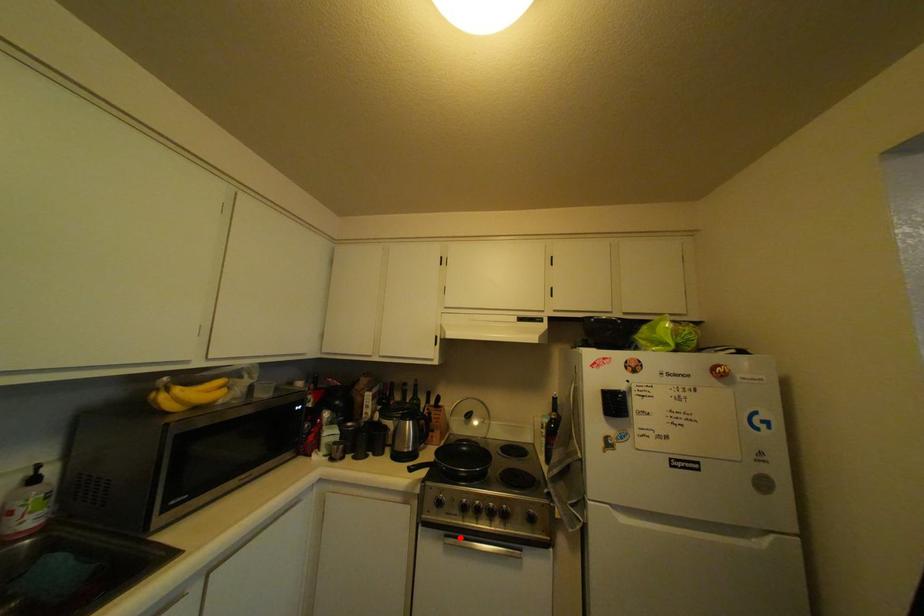
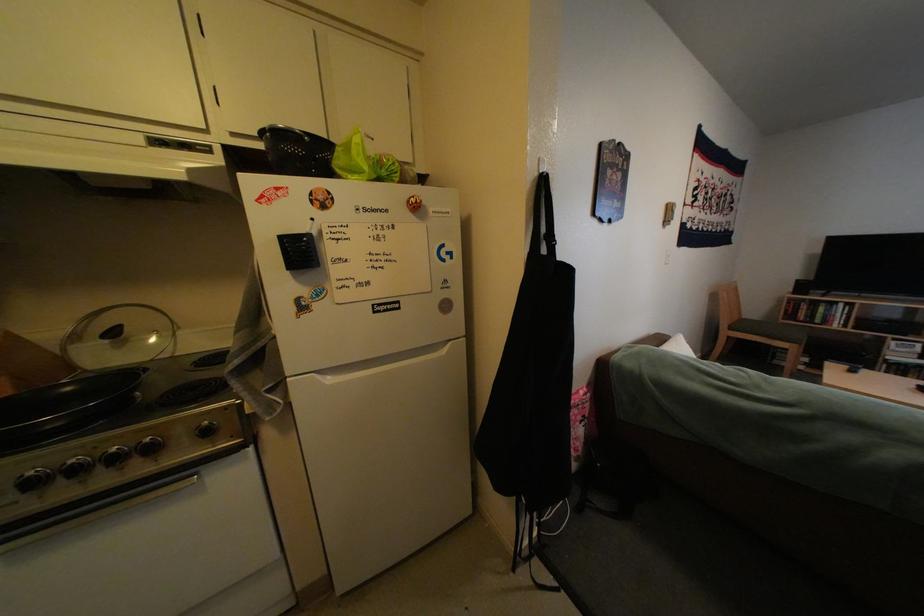
Question: I am providing you with two images of the same scene from different viewpoints. A red point is shown in image1. For the corresponding object point in image2, is it positioned nearer or farther from the camera?

Choices:
 (A) Nearer
 (B) Farther

Answer: (A)